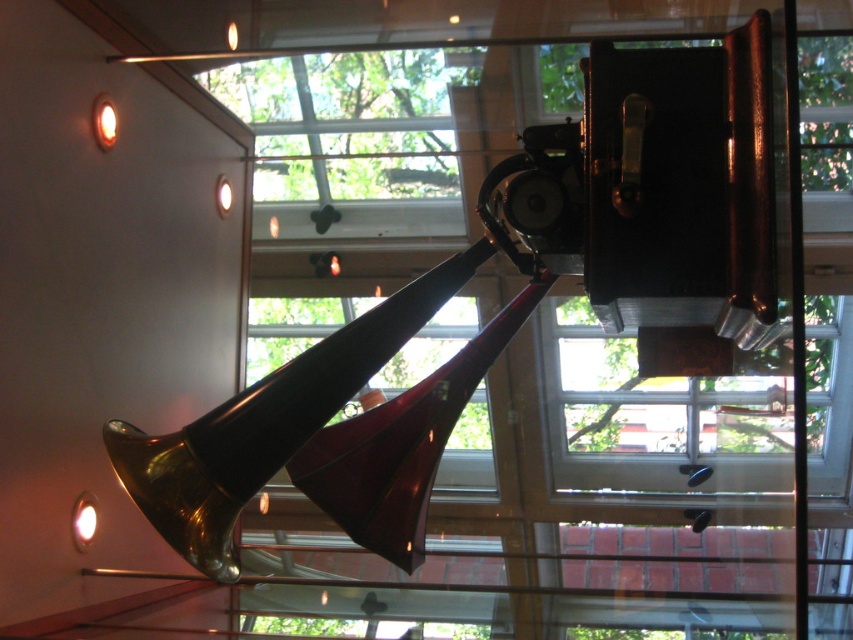
You are an interior designer assessing the lighting in the room. You notice the transparent glass window at upper center and the matte gold lamp at lower left. Which object could potentially provide more natural light to the area?

The transparent glass window at upper center could provide more natural light to the area since windows typically allow more sunlight to pass through compared to lamps, which are artificial light sources.

You are standing in front of the vintage phonograph display case. There are two points marked on the glass surface, one at coordinates point (672, 467) and the other at point (90, 508). Which of these two points is closer to your eyes?

Point (672, 467) is further to the camera than point (90, 508), so the point closer to your eyes is point (90, 508).